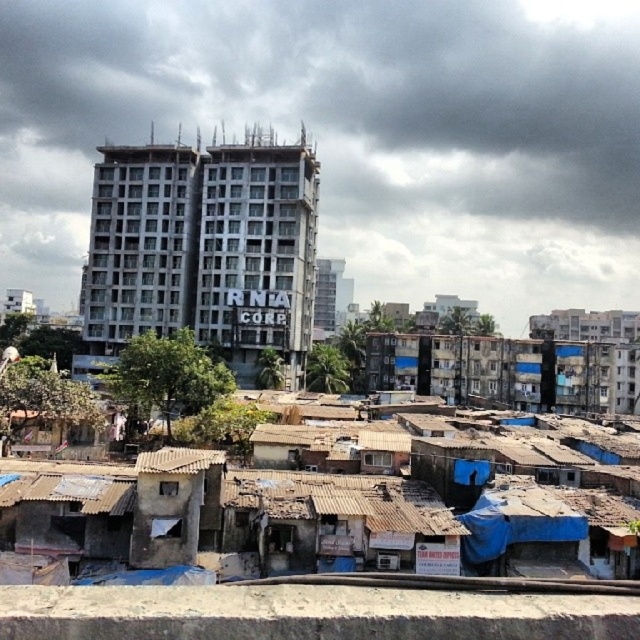
You are a city planner assessing the urban layout. You see the white concrete building at center and the rusty concrete slum at lower center. Which structure has a larger footprint in terms of width?

The white concrete building at center might be wider than rusty concrete slum at lower center according to the description.

Based on the scene description, can you determine the exact coordinates of the white concrete building at center?

The white concrete building at center is located at coordinates point (349,132).